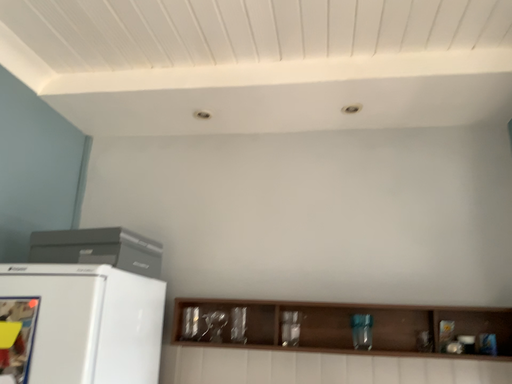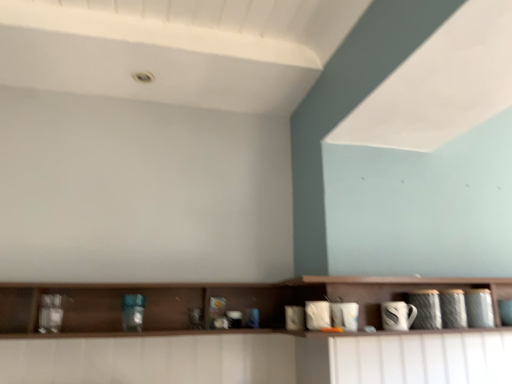
Question: How did the camera likely rotate when shooting the video?

Choices:
 (A) rotated right
 (B) rotated left

Answer: (A)